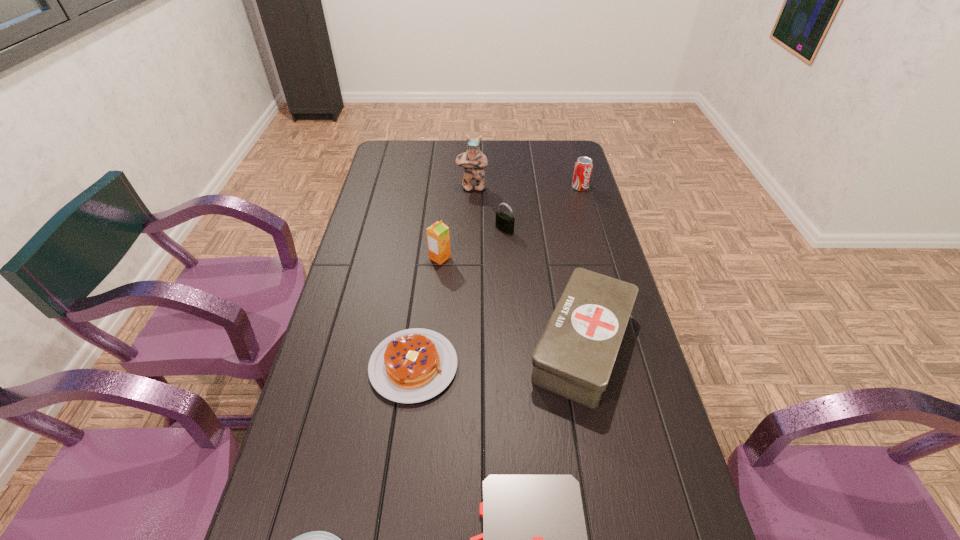
This screenshot has height=540, width=960. Identify the location of free space located 0.340m on the left of the taller first-aid kit. (401, 346).

Locate an element on the screen. The width and height of the screenshot is (960, 540). vacant space located 0.220m on the right of the sixth nearest object is located at coordinates (576, 229).

This screenshot has width=960, height=540. In order to click on free space located on the back of the farther pancake in this screenshot , I will do `click(424, 282)`.

The height and width of the screenshot is (540, 960). I want to click on object located at the left edge, so click(x=413, y=365).

This screenshot has width=960, height=540. In order to click on soda can that is at the right edge in this screenshot , I will do `click(583, 166)`.

This screenshot has height=540, width=960. Identify the location of the first-aid kit present at the right edge. (574, 358).

I want to click on free region at the far edge, so click(x=440, y=141).

Identify the location of free space at the left edge of the desktop. This screenshot has height=540, width=960. (374, 265).

In the image, there is a desktop. Identify the location of blank space at the right edge. (564, 180).

At what (x,y) coordinates should I click in order to perform the action: click on blank space at the far right corner. Please return your answer as a coordinate pair (x, y). Image resolution: width=960 pixels, height=540 pixels. Looking at the image, I should click on (570, 140).